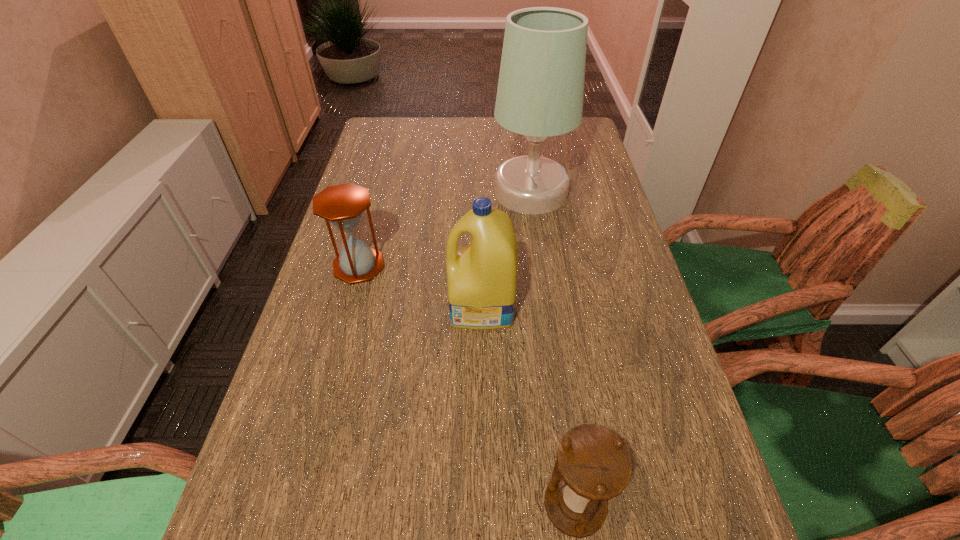
The width and height of the screenshot is (960, 540). In order to click on vacant area situated on the label of the detergent in this screenshot , I will do `click(323, 307)`.

Where is `free location located 0.050m on the label of the detergent`? The width and height of the screenshot is (960, 540). free location located 0.050m on the label of the detergent is located at coordinates (427, 307).

Identify the location of vacant space located on the label of the detergent. The height and width of the screenshot is (540, 960). (310, 307).

This screenshot has width=960, height=540. I want to click on free space located 0.350m on the back of the leftmost object, so click(x=384, y=174).

Where is `free space located 0.110m on the left of the nearest object`? This screenshot has width=960, height=540. free space located 0.110m on the left of the nearest object is located at coordinates (476, 505).

This screenshot has width=960, height=540. I want to click on object at the left edge, so click(x=342, y=205).

Find the location of `object that is at the right edge`. object that is at the right edge is located at coordinates (540, 92).

The width and height of the screenshot is (960, 540). Identify the location of free space at the far edge of the desktop. (488, 133).

You are a GUI agent. You are given a task and a screenshot of the screen. Output one action in this format:
    pyautogui.click(x=<x>, y=<y>)
    Task: Click on the free space at the left edge of the desktop
    The image size is (960, 540).
    Given the screenshot: What is the action you would take?
    pyautogui.click(x=401, y=190)

I want to click on free location at the right edge, so click(645, 308).